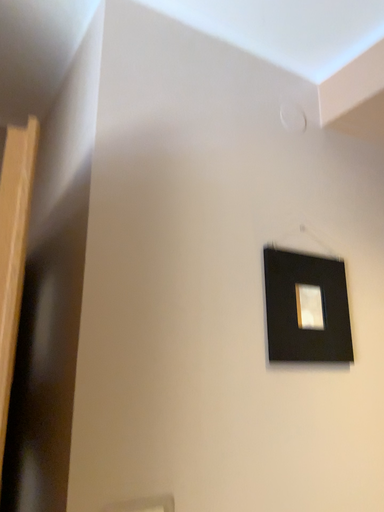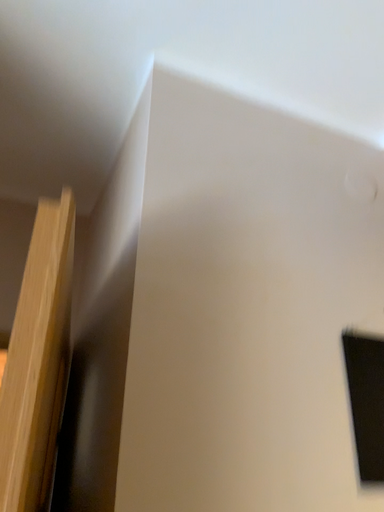
Question: How did the camera likely rotate when shooting the video?

Choices:
 (A) rotated downward
 (B) rotated upward

Answer: (B)